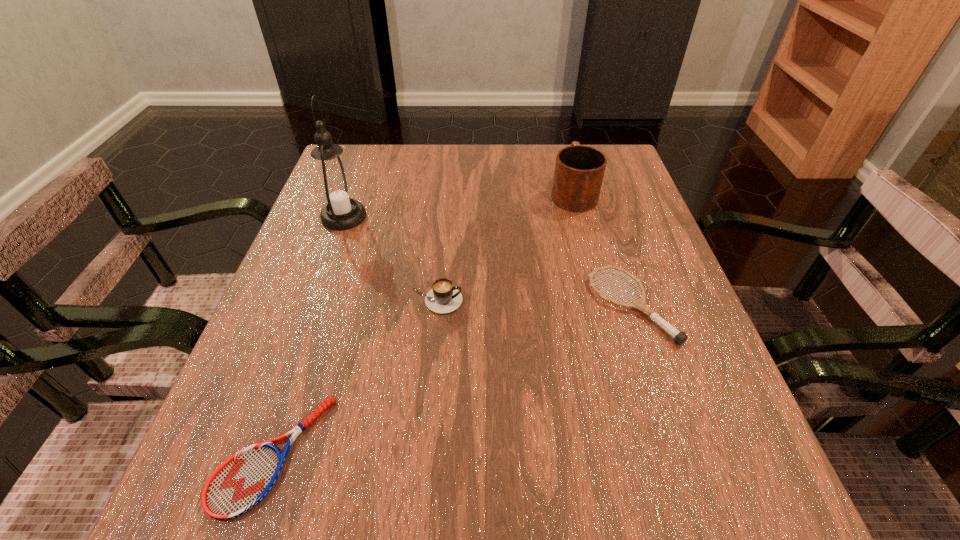
The image size is (960, 540). What are the coordinates of `the tallest object` in the screenshot? It's located at (335, 186).

I want to click on the second tallest object, so click(x=579, y=170).

Find the location of `cappuccino`. cappuccino is located at coordinates (443, 298).

This screenshot has height=540, width=960. I want to click on the third tallest object, so click(x=443, y=298).

The image size is (960, 540). Find the location of `the right tennis racket`. the right tennis racket is located at coordinates (679, 337).

Locate an element on the screen. This screenshot has height=540, width=960. the second shortest object is located at coordinates [x=679, y=337].

Identify the location of the shorter tennis racket. The height and width of the screenshot is (540, 960). (243, 480).

Identify the location of the nearer tennis racket. (243, 480).

The height and width of the screenshot is (540, 960). I want to click on vacant area located on the front of the tallest object, so click(x=322, y=281).

You are a GUI agent. You are given a task and a screenshot of the screen. Output one action in this format:
    pyautogui.click(x=<x>, y=<y>)
    Task: Click on the vacant area located 0.160m with the handle on the side of the third object from left to right
    
    Given the screenshot: What is the action you would take?
    pyautogui.click(x=547, y=301)